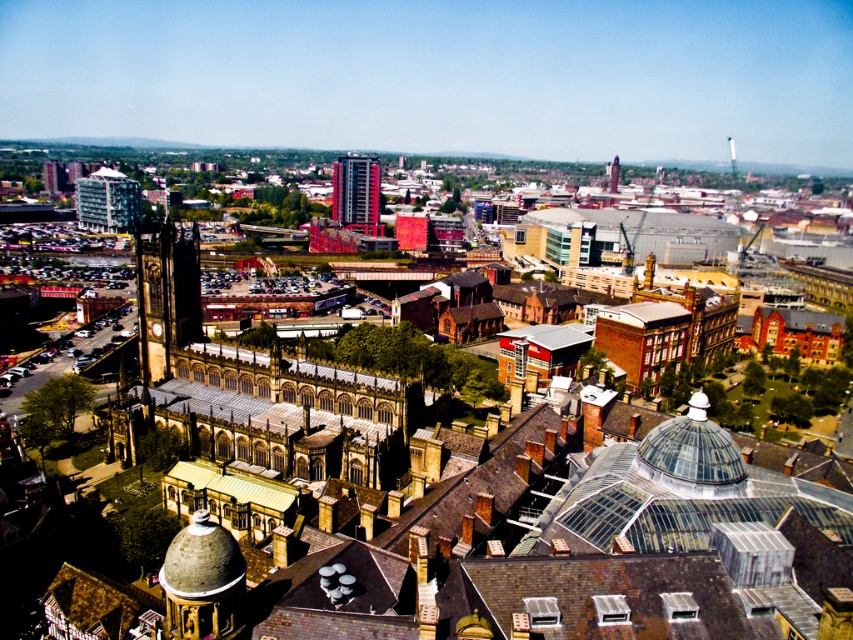
Question: Is the position of red glass tower at center more distant than that of brick tower at center?

Choices:
 (A) yes
 (B) no

Answer: (B)

Question: Which of the following is the farthest from the observer?

Choices:
 (A) (378, 209)
 (B) (612, 173)

Answer: (B)

Question: Does red glass tower at center have a smaller size compared to brick tower at center?

Choices:
 (A) no
 (B) yes

Answer: (A)

Question: Which object is the farthest from the matte glass building at left?

Choices:
 (A) red glass tower at center
 (B) brick tower at center

Answer: (B)

Question: Among these objects, which one is nearest to the camera?

Choices:
 (A) brick tower at center
 (B) matte glass building at left
 (C) red glass tower at center

Answer: (B)

Question: Does matte glass building at left have a lesser width compared to red glass tower at center?

Choices:
 (A) yes
 (B) no

Answer: (B)